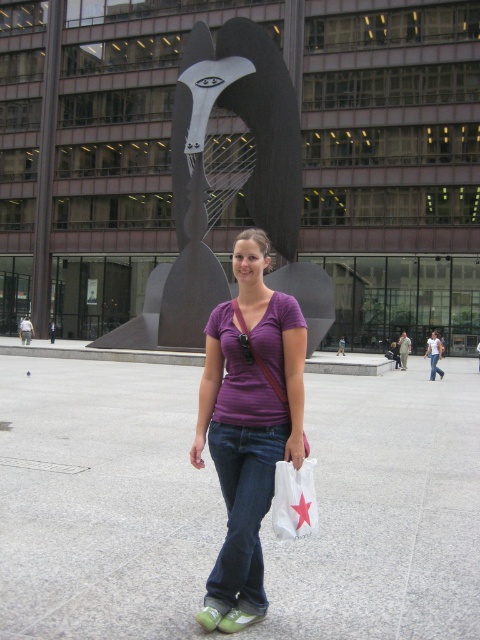
You are a photographer trying to capture the person in the scene. If you want to focus on the white plastic bag at center without the purple fabric shirt at center being visible in the shot, would adjusting the camera angle upwards help?

The white plastic bag at center is above the purple fabric shirt at center. By tilting the camera upwards, you can aim the lens towards the higher position of the white plastic bag while potentially obscuring the purple fabric shirt at center from view, so yes, adjusting the camera angle upwards would help.

You are a photographer trying to capture the entire scene in one shot. Given that the polished bronze sculpture at center and the purple cotton shirt at center are both in your viewfinder, which object will appear larger in the photo?

The polished bronze sculpture at center will appear larger in the photo because it is bigger than the purple cotton shirt at center.